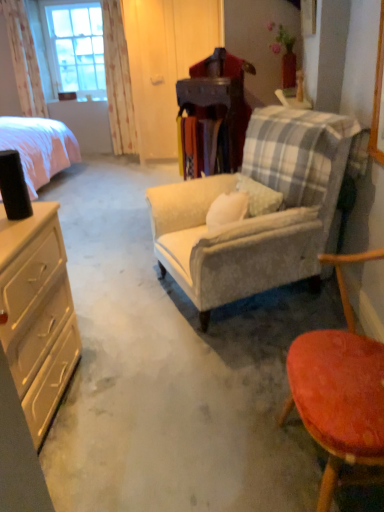
This screenshot has height=512, width=384. I want to click on white floral fabric curtain at upper left, which ranks as the second curtain in right-to-left order, so click(x=24, y=59).

Image resolution: width=384 pixels, height=512 pixels. What do you see at coordinates (118, 80) in the screenshot? I see `white floral fabric curtain at upper left, which appears as the second curtain when viewed from the left` at bounding box center [118, 80].

The width and height of the screenshot is (384, 512). Describe the element at coordinates (37, 313) in the screenshot. I see `matte beige dresser at left` at that location.

Identify the location of pink fabric bed at left. pyautogui.click(x=39, y=147).

You are a GUI agent. You are given a task and a screenshot of the screen. Output one action in this format:
    pyautogui.click(x=<x>, y=<y>)
    Task: Click on the white floral fabric curtain at upper left, which ranks as the second curtain in right-to-left order
    Image resolution: width=384 pixels, height=512 pixels.
    Given the screenshot: What is the action you would take?
    pyautogui.click(x=24, y=59)

Which is correct: clear glass window at upper left is inside smooth orange stool at lower right, which appears as the second chair when viewed from the back, or outside of it?

clear glass window at upper left cannot be found inside smooth orange stool at lower right, which appears as the second chair when viewed from the back.

In the image, is clear glass window at upper left on the left side or the right side of smooth orange stool at lower right, which appears as the second chair when viewed from the back?

Based on their positions, clear glass window at upper left is located to the left of smooth orange stool at lower right, which appears as the second chair when viewed from the back.

From a real-world perspective, is clear glass window at upper left located beneath smooth orange stool at lower right, which appears as the second chair when viewed from the back?

Actually, clear glass window at upper left is physically above smooth orange stool at lower right, which appears as the second chair when viewed from the back, in the real world.

Is smooth orange stool at lower right, positioned as the first chair in front-to-back order, at the back of clear glass window at upper left?

No.

Considering the positions of points (292, 378) and (312, 130), is point (292, 378) closer to camera compared to point (312, 130)?

Yes, it is in front of point (312, 130).

From the image's perspective, is smooth orange stool at lower right, which appears as the second chair when viewed from the back, located beneath velvet beige armchair at center, which is the second chair in front-to-back order?

Indeed, from the image's perspective, smooth orange stool at lower right, which appears as the second chair when viewed from the back, is shown beneath velvet beige armchair at center, which is the second chair in front-to-back order.

Is the position of smooth orange stool at lower right, which appears as the second chair when viewed from the back, less distant than that of velvet beige armchair at center, which is the second chair in front-to-back order?

Yes.

Is smooth orange stool at lower right, which appears as the second chair when viewed from the back, oriented towards velvet beige armchair at center, which is the second chair in front-to-back order?

No, smooth orange stool at lower right, which appears as the second chair when viewed from the back, is not aimed at velvet beige armchair at center, which is the second chair in front-to-back order.

Which is closer to the camera, (381, 361) or (62, 151)?

The point (381, 361) is closer to the camera.

Between smooth orange stool at lower right, positioned as the first chair in front-to-back order, and pink fabric bed at left, which one appears on the left side from the viewer's perspective?

From the viewer's perspective, pink fabric bed at left appears more on the left side.

Is smooth orange stool at lower right, positioned as the first chair in front-to-back order, placed right next to pink fabric bed at left?

No, smooth orange stool at lower right, positioned as the first chair in front-to-back order, is not touching pink fabric bed at left.

Is smooth orange stool at lower right, which appears as the second chair when viewed from the back, oriented away from pink fabric bed at left?

smooth orange stool at lower right, which appears as the second chair when viewed from the back, does not have its back to pink fabric bed at left.

Is point (370, 413) positioned in front of point (114, 76)?

Yes, it is.

From a real-world perspective, which chair is the 2nd one underneath the white floral fabric curtain at upper left, which appears as the second curtain when viewed from the left? Please provide its 2D coordinates.

[(340, 393)]

Is smooth orange stool at lower right, which appears as the second chair when viewed from the back, wider than white floral fabric curtain at upper left, placed as the 1th curtain when sorted from right to left?

Yes, smooth orange stool at lower right, which appears as the second chair when viewed from the back, is wider than white floral fabric curtain at upper left, placed as the 1th curtain when sorted from right to left.

Is pink fabric bed at left taller than clear glass window at upper left?

Incorrect, the height of pink fabric bed at left is not larger of that of clear glass window at upper left.

Is pink fabric bed at left touching clear glass window at upper left?

No, pink fabric bed at left is not touching clear glass window at upper left.

Which of these two, pink fabric bed at left or clear glass window at upper left, is thinner?

Thinner between the two is clear glass window at upper left.

Does point (52, 164) come behind point (98, 83)?

That is False.

Is point (127, 79) positioned behind point (373, 358)?

Yes, it is.

From the image's perspective, does white floral fabric curtain at upper left, placed as the 1th curtain when sorted from right to left, appear lower than smooth orange stool at lower right, which appears as the second chair when viewed from the back?

Actually, white floral fabric curtain at upper left, placed as the 1th curtain when sorted from right to left, appears above smooth orange stool at lower right, which appears as the second chair when viewed from the back, in the image.

Considering the relative positions of white floral fabric curtain at upper left, placed as the 1th curtain when sorted from right to left, and smooth orange stool at lower right, which appears as the second chair when viewed from the back, in the image provided, is white floral fabric curtain at upper left, placed as the 1th curtain when sorted from right to left, to the left or to the right of smooth orange stool at lower right, which appears as the second chair when viewed from the back,?

Clearly, white floral fabric curtain at upper left, placed as the 1th curtain when sorted from right to left, is on the left of smooth orange stool at lower right, which appears as the second chair when viewed from the back, in the image.

Does white floral fabric curtain at upper left, placed as the 1th curtain when sorted from right to left, have a greater height compared to smooth orange stool at lower right, which appears as the second chair when viewed from the back?

Correct, white floral fabric curtain at upper left, placed as the 1th curtain when sorted from right to left, is much taller as smooth orange stool at lower right, which appears as the second chair when viewed from the back.

Measure the distance between matte beige dresser at left and white floral fabric curtain at upper left, which appears as the second curtain when viewed from the left.

matte beige dresser at left and white floral fabric curtain at upper left, which appears as the second curtain when viewed from the left, are 4.05 meters apart.

Is matte beige dresser at left touching white floral fabric curtain at upper left, which appears as the second curtain when viewed from the left?

matte beige dresser at left is not next to white floral fabric curtain at upper left, which appears as the second curtain when viewed from the left, and they're not touching.

Can we say matte beige dresser at left lies outside white floral fabric curtain at upper left, placed as the 1th curtain when sorted from right to left?

Absolutely, matte beige dresser at left is external to white floral fabric curtain at upper left, placed as the 1th curtain when sorted from right to left.

Is matte beige dresser at left smaller than white floral fabric curtain at upper left, which appears as the second curtain when viewed from the left?

No.

At what (x,y) coordinates should I click in order to perform the action: click on chair that is the 2nd object located below the clear glass window at upper left (from the image's perspective). Please return your answer as a coordinate pair (x, y). This screenshot has height=512, width=384. Looking at the image, I should click on (340, 393).

Locate an element on the screen. The height and width of the screenshot is (512, 384). chair below the velvet beige armchair at center, which is the second chair in front-to-back order (from a real-world perspective) is located at coordinates (340, 393).

Which object lies nearer to the anchor point matte beige dresser at left, white floral fabric curtain at upper left, which appears as the second curtain when viewed from the left, or pink fabric bed at left?

pink fabric bed at left is closer to matte beige dresser at left.

Looking at this image, which object lies nearer to the anchor point smooth orange stool at lower right, which appears as the second chair when viewed from the back, white floral fabric curtain at upper left, which appears as the second curtain when viewed from the left, or velvet beige armchair at center, arranged as the first chair when viewed from the back?

velvet beige armchair at center, arranged as the first chair when viewed from the back, is closer to smooth orange stool at lower right, which appears as the second chair when viewed from the back.

Estimate the real-world distances between objects in this image. Which object is further from matte beige dresser at left, smooth orange stool at lower right, positioned as the first chair in front-to-back order, or white floral fabric curtain at upper left, placed as the 1th curtain when sorted from right to left?

white floral fabric curtain at upper left, placed as the 1th curtain when sorted from right to left, is further to matte beige dresser at left.

Considering their positions, is smooth orange stool at lower right, positioned as the first chair in front-to-back order, positioned closer to pink fabric bed at left than matte beige dresser at left?

matte beige dresser at left.

From the image, which object appears to be nearer to clear glass window at upper left, velvet beige armchair at center, arranged as the first chair when viewed from the back, or white floral fabric curtain at upper left, which ranks as the second curtain in right-to-left order?

The object closer to clear glass window at upper left is white floral fabric curtain at upper left, which ranks as the second curtain in right-to-left order.

Based on their spatial positions, is velvet beige armchair at center, arranged as the first chair when viewed from the back, or clear glass window at upper left further from pink fabric bed at left?

Based on the image, velvet beige armchair at center, arranged as the first chair when viewed from the back, appears to be further to pink fabric bed at left.

Which object lies further to the anchor point pink fabric bed at left, white floral fabric curtain at upper left, which appears as the second curtain when viewed from the left, or matte beige dresser at left?

matte beige dresser at left is further to pink fabric bed at left.

Considering their positions, is velvet beige armchair at center, which is the second chair in front-to-back order, positioned further to pink fabric bed at left than white floral fabric curtain at upper left, placed as the 1th curtain when sorted from right to left?

The object further to pink fabric bed at left is velvet beige armchair at center, which is the second chair in front-to-back order.

The image size is (384, 512). Find the location of `bed located between matte beige dresser at left and clear glass window at upper left in the depth direction`. bed located between matte beige dresser at left and clear glass window at upper left in the depth direction is located at coordinates (39, 147).

The height and width of the screenshot is (512, 384). I want to click on desk positioned between smooth orange stool at lower right, which appears as the second chair when viewed from the back, and white floral fabric curtain at upper left, which appears as the second curtain when viewed from the left, from near to far, so click(37, 313).

The image size is (384, 512). Find the location of `bed positioned between matte beige dresser at left and white floral fabric curtain at upper left, the first curtain viewed from the left, from near to far`. bed positioned between matte beige dresser at left and white floral fabric curtain at upper left, the first curtain viewed from the left, from near to far is located at coordinates (39, 147).

The height and width of the screenshot is (512, 384). I want to click on curtain between velvet beige armchair at center, which is the second chair in front-to-back order, and white floral fabric curtain at upper left, which ranks as the second curtain in right-to-left order, from front to back, so click(x=118, y=80).